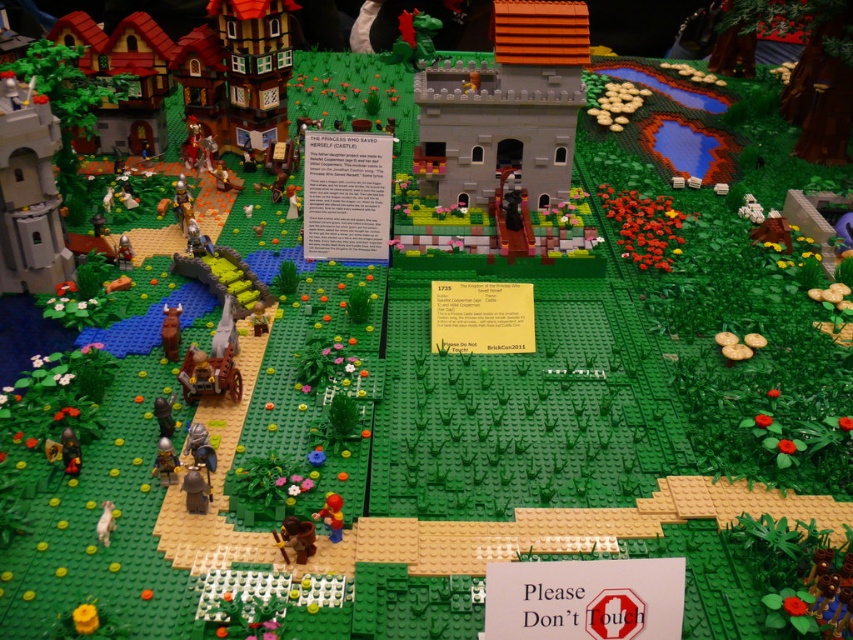
Question: Is light gray stone tower at left bigger than matte black figure at lower left?

Choices:
 (A) yes
 (B) no

Answer: (A)

Question: Does matte black figure at lower left lie behind light brown wooden horse at lower left?

Choices:
 (A) yes
 (B) no

Answer: (A)

Question: Can you confirm if matte black figure at lower left is positioned to the left of light brown wooden horse at lower left?

Choices:
 (A) no
 (B) yes

Answer: (A)

Question: Which point is closer to the camera?

Choices:
 (A) light gray stone tower at left
 (B) matte black figure at lower left
 (C) bright red plastic figure at center
 (D) light brown wooden horse at lower left

Answer: (D)

Question: Which of the following is the farthest from the observer?

Choices:
 (A) (45, 216)
 (B) (102, 541)

Answer: (A)

Question: Which object is closer to the camera taking this photo?

Choices:
 (A) matte black figure at lower left
 (B) light gray stone tower at left
 (C) bright red plastic figure at center

Answer: (C)